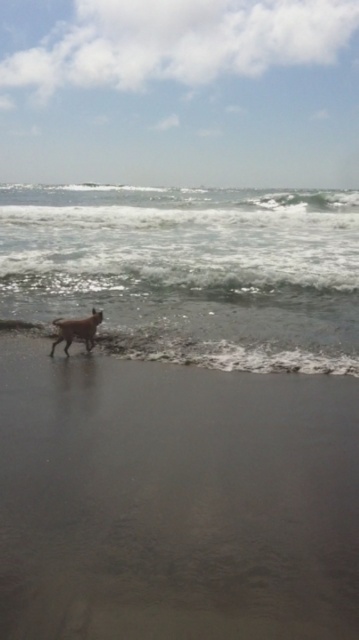
Question: Which point is closer to the camera?

Choices:
 (A) (338, 268)
 (B) (64, 340)
 (C) (50, 621)

Answer: (C)

Question: Based on their relative distances, which object is farther from the clear water at lower left?

Choices:
 (A) brown sand at lower left
 (B) brown fur dog at center

Answer: (A)

Question: Which object is positioned farthest from the brown sand at lower left?

Choices:
 (A) clear water at lower left
 (B) brown fur dog at center

Answer: (A)

Question: Does brown sand at lower left have a greater width compared to clear water at lower left?

Choices:
 (A) no
 (B) yes

Answer: (A)

Question: Is clear water at lower left above brown fur dog at center?

Choices:
 (A) yes
 (B) no

Answer: (A)

Question: Considering the relative positions of brown sand at lower left and brown fur dog at center in the image provided, where is brown sand at lower left located with respect to brown fur dog at center?

Choices:
 (A) above
 (B) below

Answer: (B)